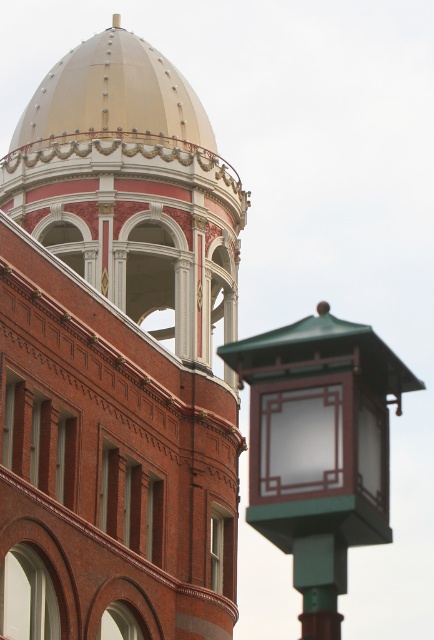
You are an architect inspecting the building. You need to determine if the green glass lantern at right can be placed on top of the brick tower at center without exceeding the building height restrictions. Based on the provided information, what is your assessment?

The brick tower at center has a greater height compared to the green glass lantern at right. Therefore, placing the green glass lantern at right on top of the brick tower at center would exceed the building height restrictions as the lantern would be higher than the tower itself.

You are an architect inspecting the building. You notice the green glass lantern at right and the gold metallic dome at upper center. Which object is positioned higher up in the structure?

The gold metallic dome at upper center is positioned higher up in the structure than the green glass lantern at right.

Looking at this image, you are standing in front of the historic building. There is a point marked at coordinates (117, 355). Based on the scene description, what architectural feature does this point most likely represent?

The point at coordinates (117, 355) corresponds to the brick tower at center, which is the prominent tower with a dome like roof painted in cream or light beige and adorned with decorative rivets.